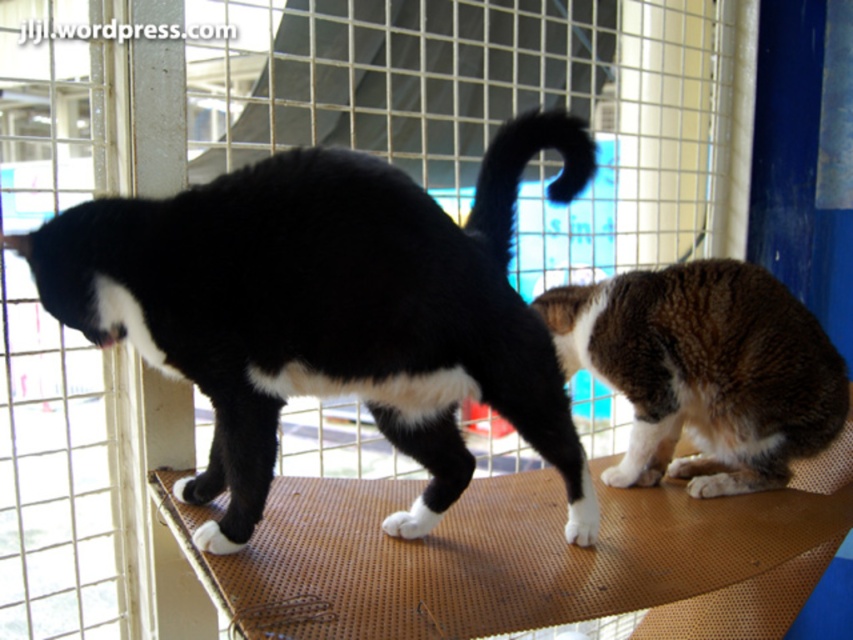
Who is more forward, [258,316] or [567,172]?

Point [258,316] is more forward.

Does black fur cat at left appear under black matte tail at center?

Indeed, black fur cat at left is positioned under black matte tail at center.

Find the location of a particular element. The width and height of the screenshot is (853, 640). black fur cat at left is located at coordinates (329, 310).

How much distance is there between brown shaggy cat at right and black matte tail at center?

brown shaggy cat at right is 18.82 inches away from black matte tail at center.

Is point (705, 449) positioned in front of point (509, 136)?

No, it is not.

Consider the image. Who is more distant from viewer, (646, 342) or (489, 253)?

Point (646, 342)

The image size is (853, 640). What are the coordinates of `brown shaggy cat at right` in the screenshot? It's located at (704, 371).

Is black fur cat at left above brown shaggy cat at right?

Yes, black fur cat at left is above brown shaggy cat at right.

Is point (41, 276) closer to camera compared to point (701, 410)?

Yes.

What do you see at coordinates (329, 310) in the screenshot? I see `black fur cat at left` at bounding box center [329, 310].

Where is `black fur cat at left`? The height and width of the screenshot is (640, 853). black fur cat at left is located at coordinates (329, 310).